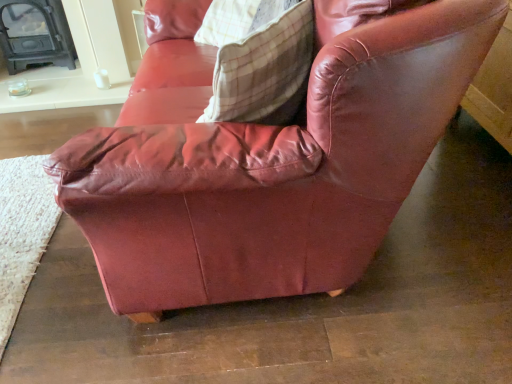
Question: Does matte black fireplace at left contain plaid fabric pillow at upper center?

Choices:
 (A) yes
 (B) no

Answer: (B)

Question: Does matte black fireplace at left have a lesser width compared to plaid fabric pillow at upper center?

Choices:
 (A) no
 (B) yes

Answer: (A)

Question: From a real-world perspective, is matte black fireplace at left on top of plaid fabric pillow at upper center?

Choices:
 (A) yes
 (B) no

Answer: (B)

Question: Is matte black fireplace at left taller than plaid fabric pillow at upper center?

Choices:
 (A) yes
 (B) no

Answer: (A)

Question: Is matte black fireplace at left to the left of plaid fabric pillow at upper center from the viewer's perspective?

Choices:
 (A) no
 (B) yes

Answer: (B)

Question: Is matte black fireplace at left positioned far away from plaid fabric pillow at upper center?

Choices:
 (A) no
 (B) yes

Answer: (B)

Question: From a real-world perspective, does plaid fabric pillow at upper center sit lower than matte black fireplace at left?

Choices:
 (A) yes
 (B) no

Answer: (B)

Question: Does plaid fabric pillow at upper center have a greater width compared to matte black fireplace at left?

Choices:
 (A) yes
 (B) no

Answer: (B)

Question: Does plaid fabric pillow at upper center lie behind matte black fireplace at left?

Choices:
 (A) yes
 (B) no

Answer: (B)

Question: Is matte black fireplace at left surrounded by plaid fabric pillow at upper center?

Choices:
 (A) no
 (B) yes

Answer: (A)

Question: Is plaid fabric pillow at upper center completely or partially outside of matte black fireplace at left?

Choices:
 (A) yes
 (B) no

Answer: (A)

Question: Does plaid fabric pillow at upper center have a smaller size compared to matte black fireplace at left?

Choices:
 (A) no
 (B) yes

Answer: (B)

Question: From their relative heights in the image, would you say plaid fabric pillow at upper center is taller or shorter than matte black fireplace at left?

Choices:
 (A) short
 (B) tall

Answer: (A)